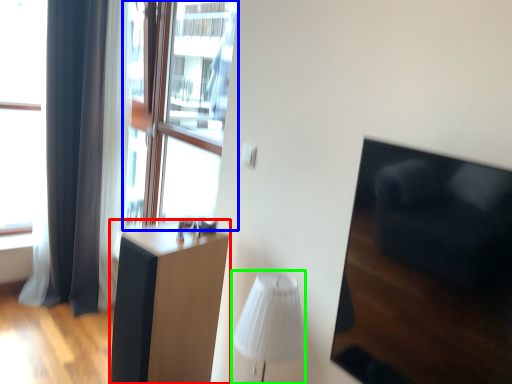
Question: Which is nearer to the furniture (highlighted by a red box)? window screen (highlighted by a blue box) or table lamp (highlighted by a green box).

Choices:
 (A) window screen
 (B) table lamp

Answer: (B)